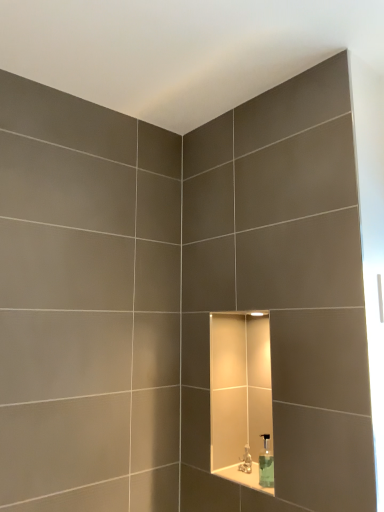
Where is `vacant area on the back side of clear glass soap dispenser at center`? This screenshot has width=384, height=512. vacant area on the back side of clear glass soap dispenser at center is located at coordinates (247, 479).